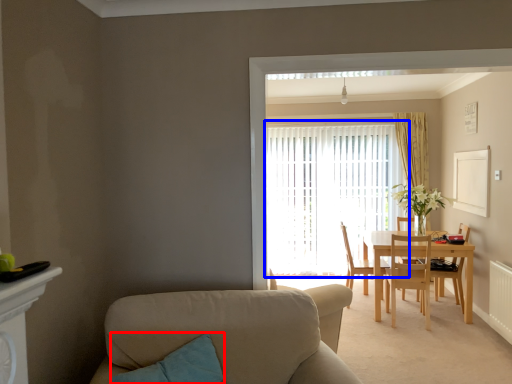
Question: Among these objects, which one is farthest to the camera, pillow (highlighted by a red box) or window (highlighted by a blue box)?

Choices:
 (A) pillow
 (B) window

Answer: (B)